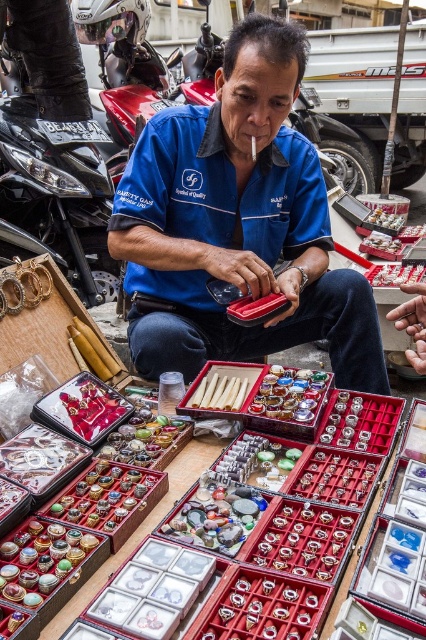
Question: Which of the following is the closest to the observer?

Choices:
 (A) (8, 282)
 (B) (281, 416)

Answer: (B)

Question: Does blue fabric shirt at center have a larger size compared to gold metallic bracelet at left?

Choices:
 (A) no
 (B) yes

Answer: (B)

Question: Is blue fabric shirt at center below shiny gold ring at center?

Choices:
 (A) no
 (B) yes

Answer: (A)

Question: Among these points, which one is nearest to the camera?

Choices:
 (A) (302, 390)
 (B) (224, 160)
 (C) (13, 273)

Answer: (A)

Question: Which point is closer to the camera?

Choices:
 (A) (288, 236)
 (B) (290, 390)
 (C) (40, 264)

Answer: (B)

Question: Is shiny gold ring at center closer to the viewer compared to gold metallic bracelet at left?

Choices:
 (A) yes
 (B) no

Answer: (A)